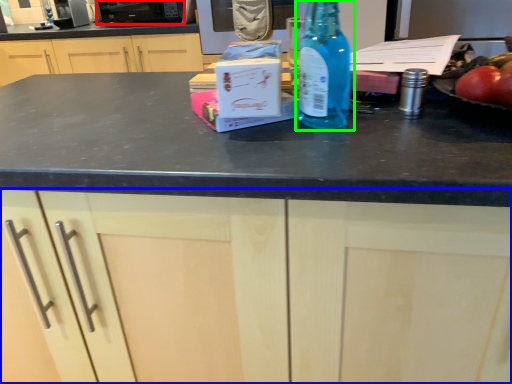
Question: Which object is the closest to the appliance (highlighted by a red box)? Choose among these: cabinetry (highlighted by a blue box) or bottle (highlighted by a green box).

Choices:
 (A) cabinetry
 (B) bottle

Answer: (B)